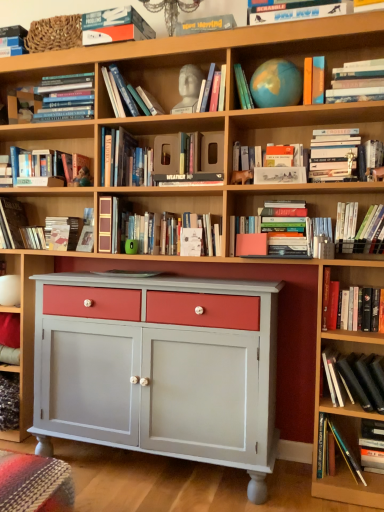
Question: From the image's perspective, is hardcover books at upper center, which is the 3th book from top to bottom, beneath black matte book at lower right, the fourteenth book viewed from the top?

Choices:
 (A) yes
 (B) no

Answer: (B)

Question: Is hardcover books at upper center, the fourteenth book in the bottom-to-top sequence, at the right side of black matte book at lower right, the fourteenth book viewed from the top?

Choices:
 (A) no
 (B) yes

Answer: (A)

Question: Is hardcover books at upper center, which is the 3th book from top to bottom, behind black matte book at lower right, the fourteenth book viewed from the top?

Choices:
 (A) no
 (B) yes

Answer: (B)

Question: Is hardcover books at upper center, which is the 3th book from top to bottom, not within black matte book at lower right, the fourteenth book viewed from the top?

Choices:
 (A) no
 (B) yes

Answer: (B)

Question: Is hardcover books at upper center, the fourteenth book in the bottom-to-top sequence, surrounding black matte book at lower right, the fourteenth book viewed from the top?

Choices:
 (A) yes
 (B) no

Answer: (B)

Question: Is hardcover books at upper center, the fourteenth book in the bottom-to-top sequence, touching black matte book at lower right, the fourteenth book viewed from the top?

Choices:
 (A) yes
 (B) no

Answer: (B)

Question: Does white marble bust at upper center, which appears as the 5th book when viewed from the top, appear on the left side of hardcover book at upper right, which is the eighth book from top to bottom?

Choices:
 (A) no
 (B) yes

Answer: (B)

Question: Is white marble bust at upper center, which appears as the 5th book when viewed from the top, positioned far away from hardcover book at upper right, which is the eighth book from top to bottom?

Choices:
 (A) yes
 (B) no

Answer: (B)

Question: From the image's perspective, is white marble bust at upper center, which appears as the 5th book when viewed from the top, beneath hardcover book at upper right, marked as the ninth book in a bottom-to-top arrangement?

Choices:
 (A) no
 (B) yes

Answer: (A)

Question: From the image's perspective, is white marble bust at upper center, which ranks as the 12th book in bottom-to-top order, on hardcover book at upper right, which is the eighth book from top to bottom?

Choices:
 (A) yes
 (B) no

Answer: (A)

Question: From a real-world perspective, is white marble bust at upper center, which appears as the 5th book when viewed from the top, physically above hardcover book at upper right, marked as the ninth book in a bottom-to-top arrangement?

Choices:
 (A) yes
 (B) no

Answer: (A)

Question: Is white marble bust at upper center, which appears as the 5th book when viewed from the top, closer to the viewer compared to hardcover book at upper right, marked as the ninth book in a bottom-to-top arrangement?

Choices:
 (A) no
 (B) yes

Answer: (A)

Question: Is matte blue globe at upper center, which ranks as the eleventh book in bottom-to-top order, positioned before hardcover book at upper right, positioned as the 10th book in top-to-bottom order?

Choices:
 (A) no
 (B) yes

Answer: (A)